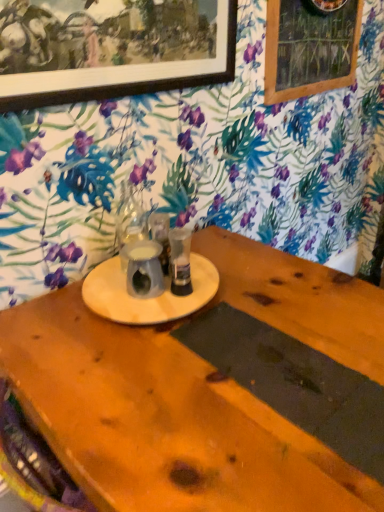
The image size is (384, 512). Find the location of `blank space above dark gray matte placemat at bottom center (from a real-world perspective)`. blank space above dark gray matte placemat at bottom center (from a real-world perspective) is located at coordinates (274, 365).